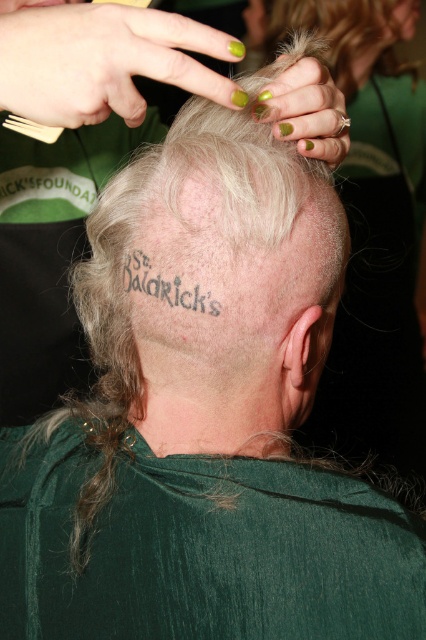
You are a tattoo artist observing the back of a person. You notice the gray tattooed skin at center and the black tattoo at center back. Which one has a greater width?

The gray tattooed skin at center has a greater width than the black tattoo at center back.

You are standing in front of the person and want to touch the point at coordinates point [247,124] and point [155,296]. Which point is closer to you?

Point [155,296] is closer to you because it is in front of point [247,124].

You are a tattoo artist examining the back of a person. You see the gray tattooed skin at center and the black tattoo at center back. Which tattoo is closer to the top of the head?

The gray tattooed skin at center is positioned over the black tattoo at center back, so the gray tattooed skin at center is closer to the top of the head.